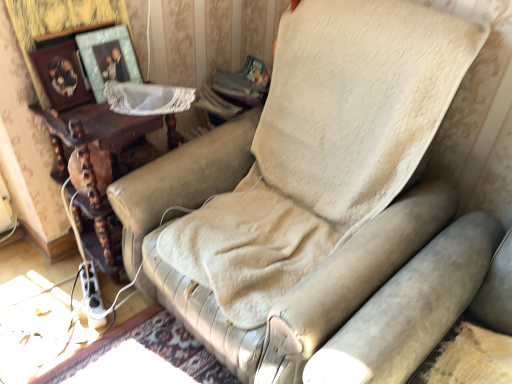
Question: Is wooden photo frame at upper left, which is the first picture frame in left-to-right order, behind brown wooden table at left?

Choices:
 (A) no
 (B) yes

Answer: (A)

Question: From the image's perspective, is wooden photo frame at upper left, which is the first picture frame in left-to-right order, below brown wooden table at left?

Choices:
 (A) no
 (B) yes

Answer: (A)

Question: From a real-world perspective, is wooden photo frame at upper left, which is the first picture frame in left-to-right order, on brown wooden table at left?

Choices:
 (A) no
 (B) yes

Answer: (B)

Question: Is wooden photo frame at upper left, which is the first picture frame in left-to-right order, at the left side of brown wooden table at left?

Choices:
 (A) yes
 (B) no

Answer: (A)

Question: Would you say wooden photo frame at upper left, which is the first picture frame in left-to-right order, is outside brown wooden table at left?

Choices:
 (A) yes
 (B) no

Answer: (A)

Question: Is metallic silver picture frame at upper left, which ranks as the 1th picture frame in right-to-left order, in front of or behind brown wooden table at left in the image?

Choices:
 (A) behind
 (B) front

Answer: (A)

Question: Would you say metallic silver picture frame at upper left, which appears as the second picture frame when viewed from the left, is to the left or to the right of brown wooden table at left in the picture?

Choices:
 (A) left
 (B) right

Answer: (B)

Question: In terms of width, does metallic silver picture frame at upper left, which ranks as the 1th picture frame in right-to-left order, look wider or thinner when compared to brown wooden table at left?

Choices:
 (A) wide
 (B) thin

Answer: (B)

Question: Does point (95, 44) appear closer or farther from the camera than point (168, 135)?

Choices:
 (A) farther
 (B) closer

Answer: (B)

Question: Is brown wooden table at left to the left or to the right of metallic silver picture frame at upper left, which ranks as the 1th picture frame in right-to-left order, in the image?

Choices:
 (A) right
 (B) left

Answer: (B)

Question: Is brown wooden table at left taller or shorter than metallic silver picture frame at upper left, which ranks as the 1th picture frame in right-to-left order?

Choices:
 (A) short
 (B) tall

Answer: (B)

Question: Considering the positions of brown wooden table at left and metallic silver picture frame at upper left, which ranks as the 1th picture frame in right-to-left order, in the image, is brown wooden table at left wider or thinner than metallic silver picture frame at upper left, which ranks as the 1th picture frame in right-to-left order,?

Choices:
 (A) wide
 (B) thin

Answer: (A)

Question: From a real-world perspective, is brown wooden table at left positioned above or below metallic silver picture frame at upper left, which appears as the second picture frame when viewed from the left?

Choices:
 (A) below
 (B) above

Answer: (A)

Question: Is wooden photo frame at upper left, which is the first picture frame in left-to-right order, to the left or to the right of brown wooden table at left in the image?

Choices:
 (A) left
 (B) right

Answer: (A)

Question: From their relative heights in the image, would you say wooden photo frame at upper left, which appears as the second picture frame when viewed from the right, is taller or shorter than brown wooden table at left?

Choices:
 (A) tall
 (B) short

Answer: (B)